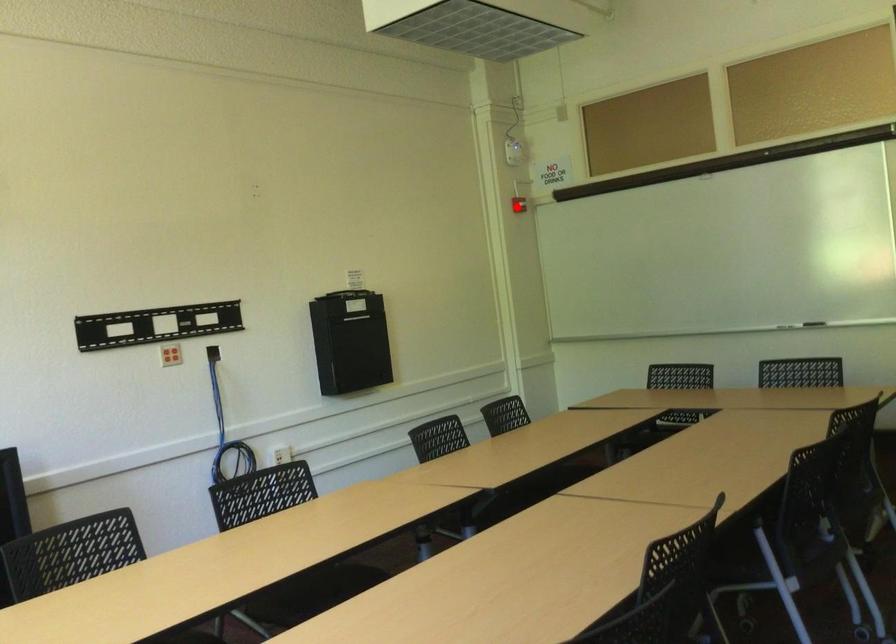
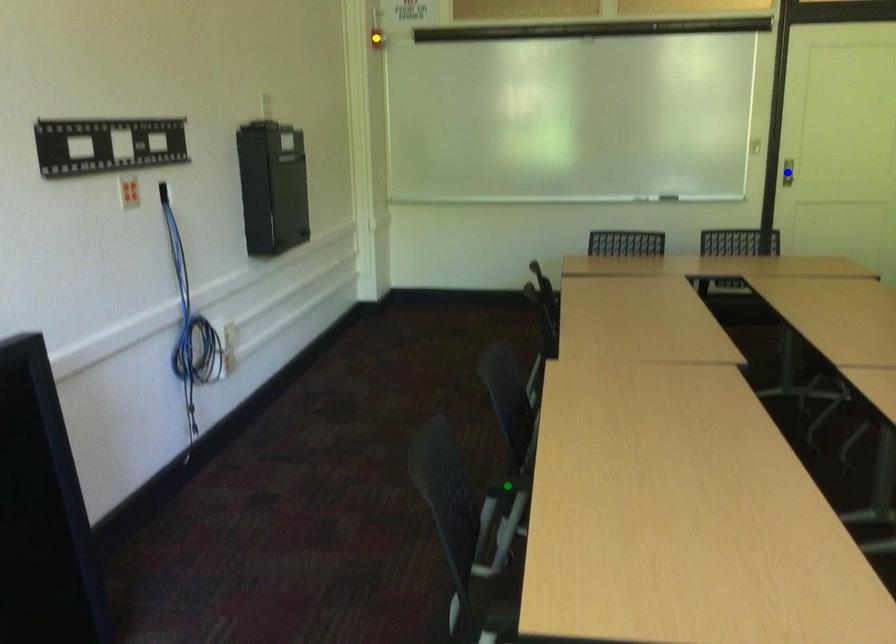
Question: I am providing you with two images of the same scene from different viewpoints. A red point is marked on the first image. You are given multiple points on the second image. In image 2, which mark is for the same physical point as the one in image 1?

Choices:
 (A) blue point
 (B) yellow point
 (C) green point

Answer: (B)